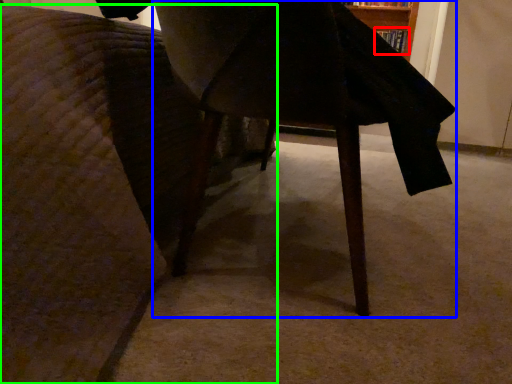
Question: Which object is positioned closest to book (highlighted by a red box)? Select from table (highlighted by a blue box) and furniture (highlighted by a green box).

Choices:
 (A) table
 (B) furniture

Answer: (A)